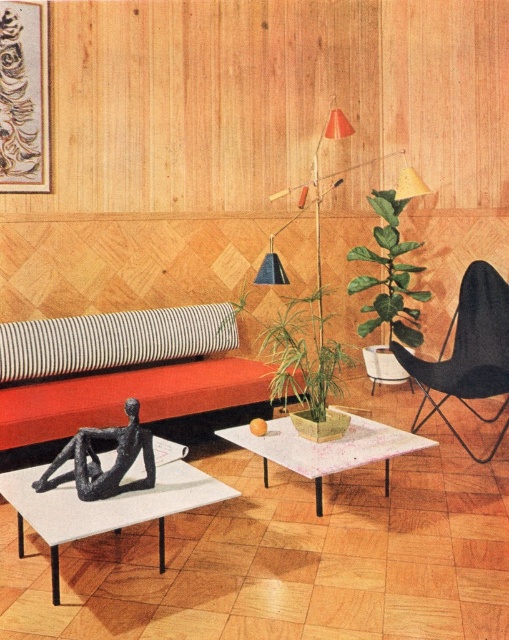
Does point (178, 349) come farther from viewer compared to point (426, 292)?

No, it is not.

The width and height of the screenshot is (509, 640). What do you see at coordinates (112, 340) in the screenshot? I see `white striped cushion at center` at bounding box center [112, 340].

Identify the location of white striped cushion at center. (112, 340).

Does speckled white table at center appear over green leafy plant at upper right?

Actually, speckled white table at center is below green leafy plant at upper right.

Does speckled white table at center lie in front of green leafy plant at upper right?

Yes, speckled white table at center is in front of green leafy plant at upper right.

Who is more forward, (358,417) or (390,317)?

Point (358,417)

At what (x,y) coordinates should I click in order to perform the action: click on speckled white table at center. Please return your answer as a coordinate pair (x, y). Looking at the image, I should click on (326, 449).

Who is positioned more to the right, green leafy plant at upper right or black matte sculpture at lower left?

From the viewer's perspective, green leafy plant at upper right appears more on the right side.

Does green leafy plant at upper right appear on the right side of black matte sculpture at lower left?

Yes, green leafy plant at upper right is to the right of black matte sculpture at lower left.

Does point (370, 305) come closer to viewer compared to point (144, 436)?

No, (370, 305) is further to viewer.

Identify the location of green leafy plant at upper right. (388, 275).